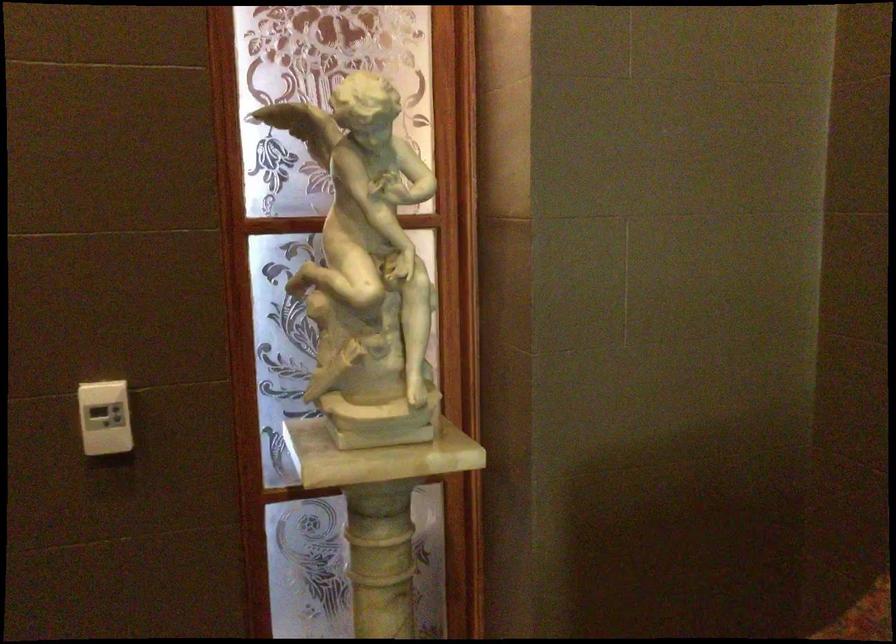
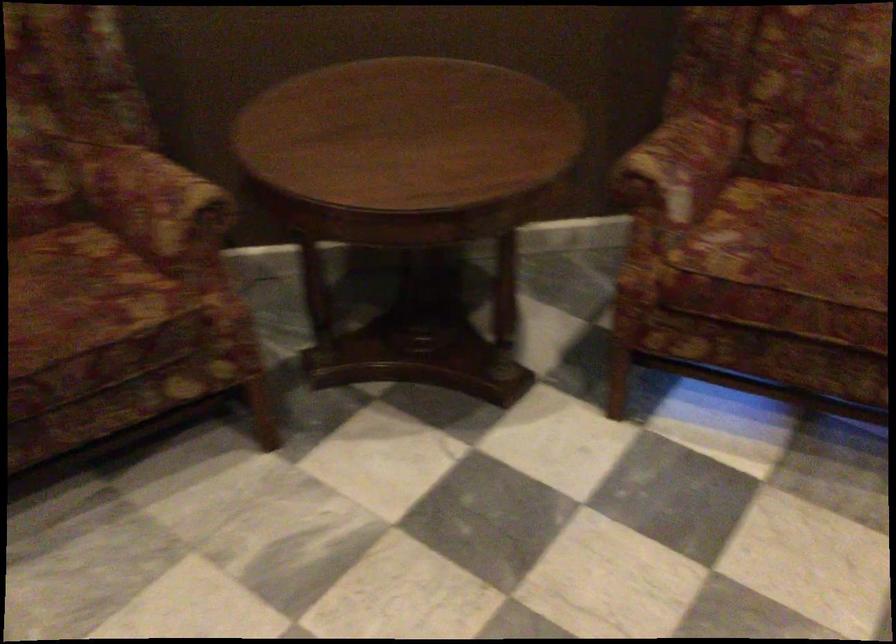
The images are taken continuously from a first-person perspective. In which direction is your viewpoint rotating?

The camera rotated toward right-down.